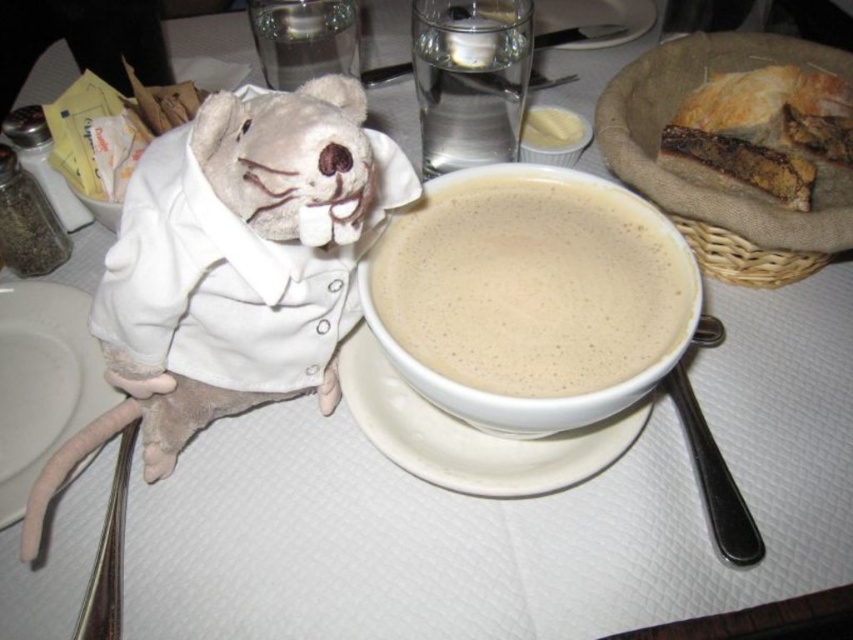
Question: Which point is farther to the camera?

Choices:
 (A) white matte plate at lower left
 (B) brown crusty bread at upper right
 (C) white matte soup at center
 (D) white ceramic saucer at center

Answer: (B)

Question: Where is fuzzy plush toy at upper left located in relation to brown crusty bread at upper right in the image?

Choices:
 (A) right
 (B) left

Answer: (B)

Question: Which point is farther to the camera?

Choices:
 (A) white ceramic saucer at center
 (B) buttery white bread at upper right
 (C) white matte soup at center

Answer: (B)

Question: Does fuzzy plush toy at upper left have a greater width compared to buttery white bread at upper right?

Choices:
 (A) no
 (B) yes

Answer: (B)

Question: Can you confirm if brown crusty bread at upper right is smaller than white ceramic saucer at center?

Choices:
 (A) no
 (B) yes

Answer: (A)

Question: Estimate the real-world distances between objects in this image. Which object is farther from the buttery white bread at upper right?

Choices:
 (A) white matte plate at lower left
 (B) fuzzy plush toy at upper left

Answer: (A)